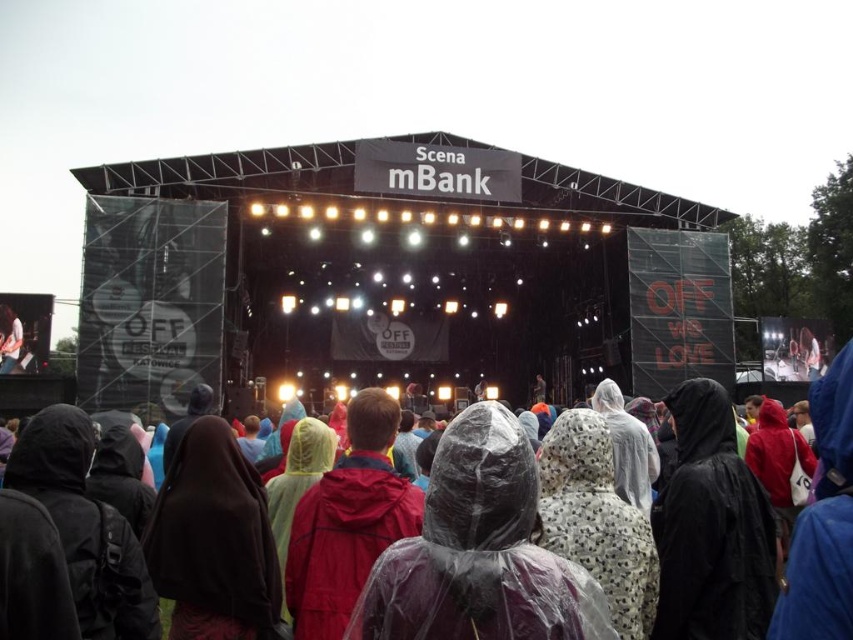
You are a photographer at the festival trying to capture a shot of the crowd. You notice the transparent plastic poncho at center and the white glossy shoe at center. Which object should you focus on first if you want to photograph the one closer to the left side?

The white glossy shoe at center is closer to the left side because the transparent plastic poncho at center is to the right of it.

You are a photographer at the concert and want to take a photo of the white glossy shoe at center without the transparent plastic poncho at center blocking it. Is it possible to angle your camera so that the poncho doesn

The transparent plastic poncho at center is taller than the white glossy shoe at center, so angling the camera might still show the shoe if positioned correctly, but the poncho could partially block it depending on the angle.